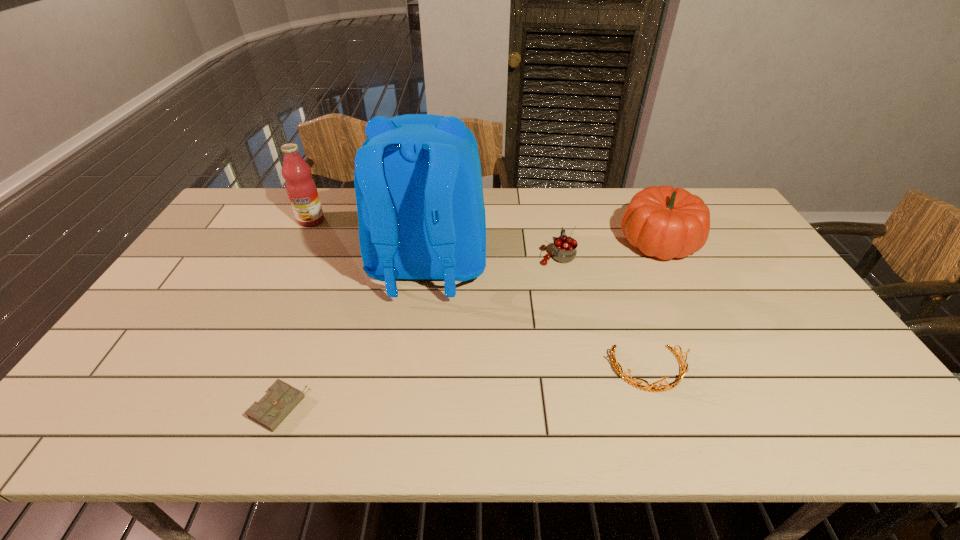
Locate an element on the screen. The width and height of the screenshot is (960, 540). object located at the near edge is located at coordinates (280, 400).

Locate an element on the screen. The height and width of the screenshot is (540, 960). vacant space at the far edge is located at coordinates (589, 208).

At what (x,y) coordinates should I click in order to perform the action: click on vacant point located between the fourth shortest object and the shortest object. Please return your answer as a coordinate pair (x, y). The height and width of the screenshot is (540, 960). Looking at the image, I should click on (468, 325).

Image resolution: width=960 pixels, height=540 pixels. I want to click on free space that is in between the pumpkin and the second shortest object, so click(654, 306).

At what (x,y) coordinates should I click in order to perform the action: click on vacant area that lies between the fourth tallest object and the second object from left to right. Please return your answer as a coordinate pair (x, y). This screenshot has height=540, width=960. Looking at the image, I should click on (418, 332).

Identify the location of free space between the fruit juice and the fifth object from right to left. This screenshot has width=960, height=540. (295, 314).

Locate an element on the screen. The height and width of the screenshot is (540, 960). vacant space that's between the second shortest object and the fourth object from left to right is located at coordinates (603, 313).

You are a GUI agent. You are given a task and a screenshot of the screen. Output one action in this format:
    pyautogui.click(x=<x>, y=<y>)
    Task: Click on the free space that is in between the fifth shortest object and the second object from left to right
    This screenshot has height=540, width=960.
    Given the screenshot: What is the action you would take?
    pyautogui.click(x=295, y=314)

Where is `empty space between the tiara and the tallest object`? Image resolution: width=960 pixels, height=540 pixels. empty space between the tiara and the tallest object is located at coordinates (539, 318).

Identify the location of free point between the shortest object and the fourth shortest object. (468, 325).